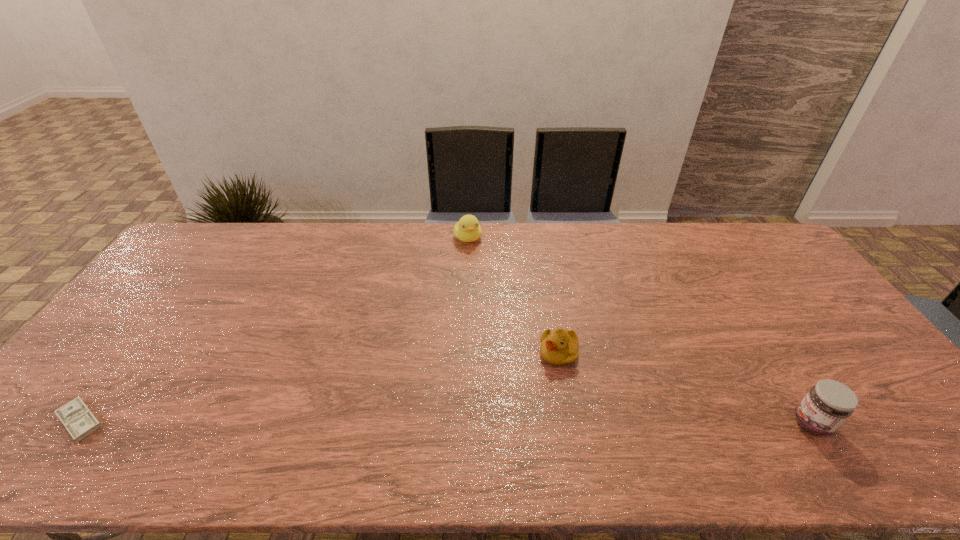
Where is `vacant space on the desktop that is between the leftmost object and the jam and is positioned on the front-facing side of the second farthest object`? vacant space on the desktop that is between the leftmost object and the jam and is positioned on the front-facing side of the second farthest object is located at coordinates (492, 422).

At what (x,y) coordinates should I click in order to perform the action: click on vacant space on the desktop that is between the money and the jam and is positioned at the beak of the farther duckling. Please return your answer as a coordinate pair (x, y). This screenshot has height=540, width=960. Looking at the image, I should click on (545, 422).